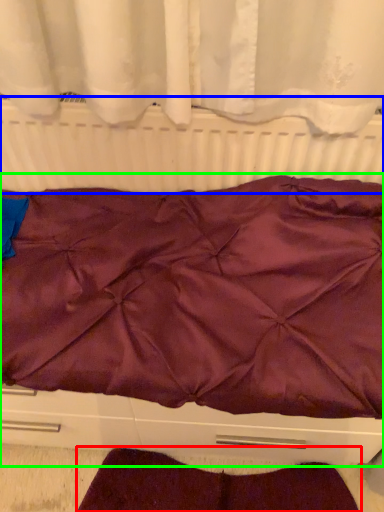
Question: Estimate the real-world distances between objects in this image. Which object is closer to blanket (highlighted by a red box), radiator (highlighted by a blue box) or furniture (highlighted by a green box)?

Choices:
 (A) radiator
 (B) furniture

Answer: (B)